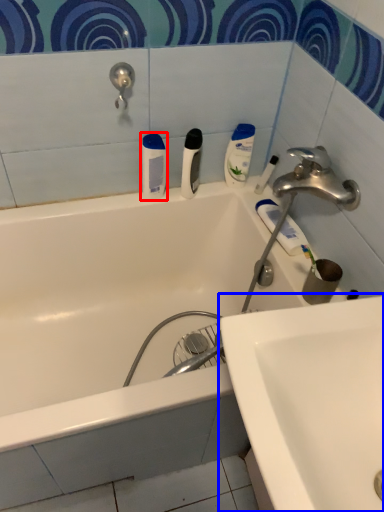
Question: Which object appears farthest to the camera in this image, toiletry (highlighted by a red box) or sink (highlighted by a blue box)?

Choices:
 (A) toiletry
 (B) sink

Answer: (A)